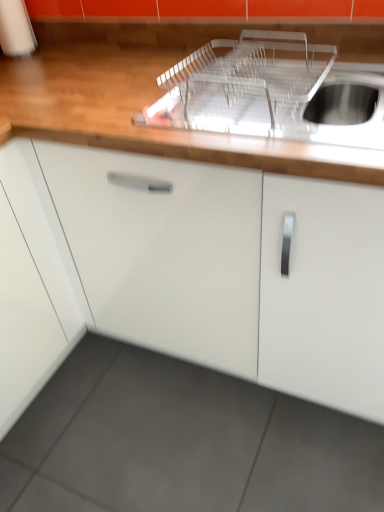
Question: Is white glossy cabinet at center positioned far away from transparent plastic sink at upper right?

Choices:
 (A) no
 (B) yes

Answer: (A)

Question: Is white glossy cabinet at center oriented towards transparent plastic sink at upper right?

Choices:
 (A) yes
 (B) no

Answer: (B)

Question: Is white glossy cabinet at center bigger than transparent plastic sink at upper right?

Choices:
 (A) no
 (B) yes

Answer: (B)

Question: From the image's perspective, is white glossy cabinet at center under transparent plastic sink at upper right?

Choices:
 (A) no
 (B) yes

Answer: (B)

Question: From the image's perspective, is white glossy cabinet at center on transparent plastic sink at upper right?

Choices:
 (A) yes
 (B) no

Answer: (B)

Question: Does white glossy cabinet at center contain transparent plastic sink at upper right?

Choices:
 (A) no
 (B) yes

Answer: (B)

Question: Can you confirm if white glossy cabinet at center is positioned to the right of transparent plastic dish rack at upper center?

Choices:
 (A) yes
 (B) no

Answer: (B)

Question: Is white glossy cabinet at center shorter than transparent plastic dish rack at upper center?

Choices:
 (A) yes
 (B) no

Answer: (B)

Question: Would you say white glossy cabinet at center is a long distance from transparent plastic dish rack at upper center?

Choices:
 (A) yes
 (B) no

Answer: (B)

Question: Does white glossy cabinet at center lie in front of transparent plastic dish rack at upper center?

Choices:
 (A) yes
 (B) no

Answer: (A)

Question: From a real-world perspective, is white glossy cabinet at center physically below transparent plastic dish rack at upper center?

Choices:
 (A) yes
 (B) no

Answer: (A)

Question: Considering the relative sizes of white glossy cabinet at center and transparent plastic dish rack at upper center in the image provided, is white glossy cabinet at center bigger than transparent plastic dish rack at upper center?

Choices:
 (A) no
 (B) yes

Answer: (B)

Question: Is the depth of transparent plastic dish rack at upper center greater than that of white glossy cabinet at center?

Choices:
 (A) no
 (B) yes

Answer: (B)